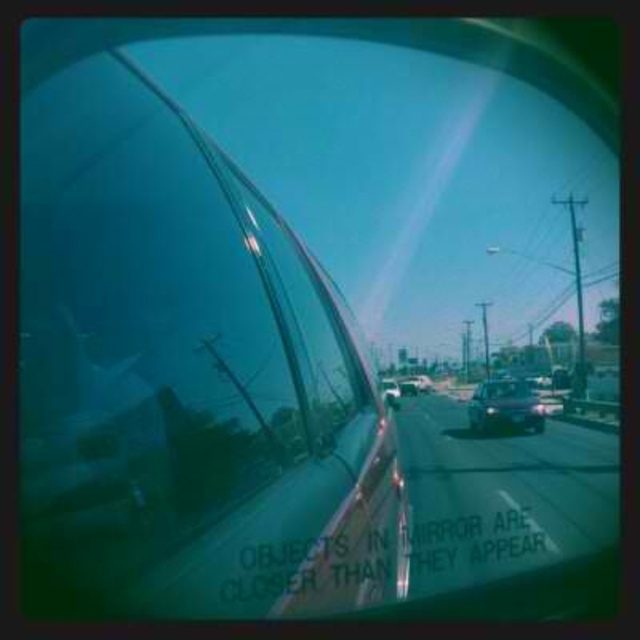
In the scene shown: You are a passenger in the vehicle and notice two cars outside through the windshield. The shiny metallic car at center and the shiny silver sedan at center. Which one is closer to you based on their positions?

The shiny metallic car at center is positioned under the shiny silver sedan at center, so the shiny metallic car at center is closer to you.

You are a passenger in the car and want to see the road ahead clearly. Is the transparent glass car window at center positioned in a way that allows you to view the road without obstruction?

The transparent glass car window at center is located at point (186, 371), which is centrally positioned to provide an unobstructed view of the road ahead. Yes, you can see the road clearly through it.